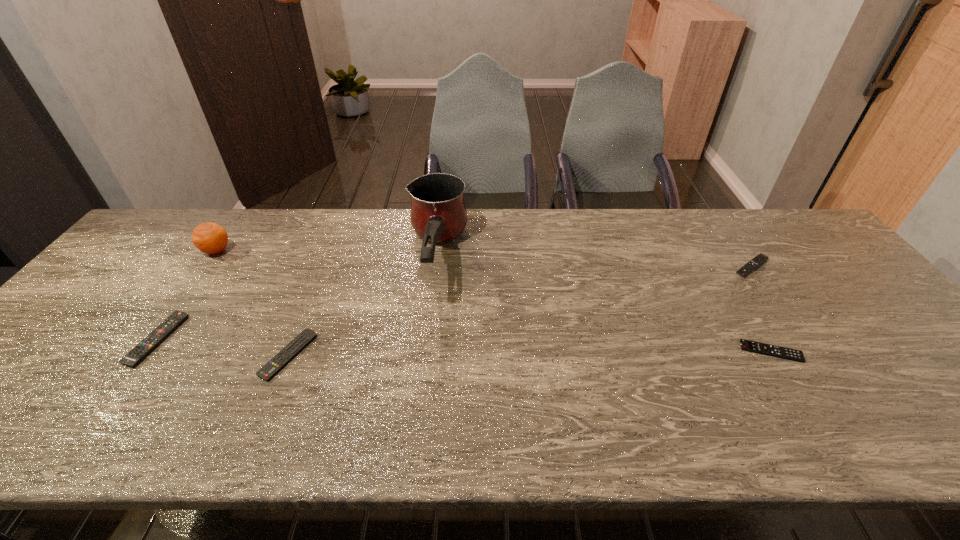
This screenshot has height=540, width=960. What are the coordinates of `saucepan` in the screenshot? It's located at (438, 212).

You are a GUI agent. You are given a task and a screenshot of the screen. Output one action in this format:
    pyautogui.click(x=<x>, y=<y>)
    Task: Click on the third object from right to left
    The image size is (960, 540).
    Given the screenshot: What is the action you would take?
    pyautogui.click(x=438, y=212)

What are the coordinates of `orange` in the screenshot? It's located at (210, 238).

Where is `the farthest remote control`? the farthest remote control is located at coordinates (760, 258).

Locate an element on the screen. Image resolution: width=960 pixels, height=540 pixels. the leftmost remote control is located at coordinates (159, 334).

Where is `the third object from left to right`? This screenshot has height=540, width=960. the third object from left to right is located at coordinates (x=289, y=352).

Where is `the shortest remote control`? the shortest remote control is located at coordinates (746, 345).

This screenshot has height=540, width=960. I want to click on vacant area situated 0.150m on the handle side of the saucepan, so click(x=424, y=357).

Find the location of a particular element. The width and height of the screenshot is (960, 540). vacant area located on the front of the fifth shortest object is located at coordinates (169, 318).

This screenshot has height=540, width=960. Identify the location of free location located 0.130m on the back of the farthest remote control. (726, 231).